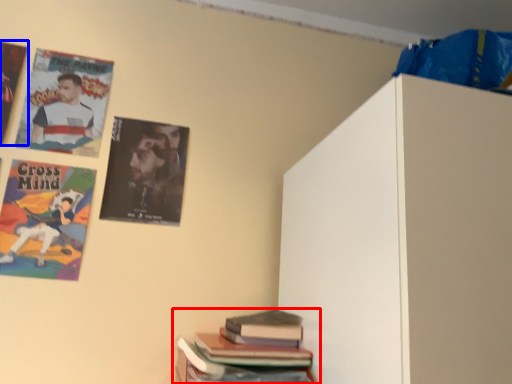
Question: Among these objects, which one is farthest to the camera, book (highlighted by a red box) or poster (highlighted by a blue box)?

Choices:
 (A) book
 (B) poster

Answer: (B)